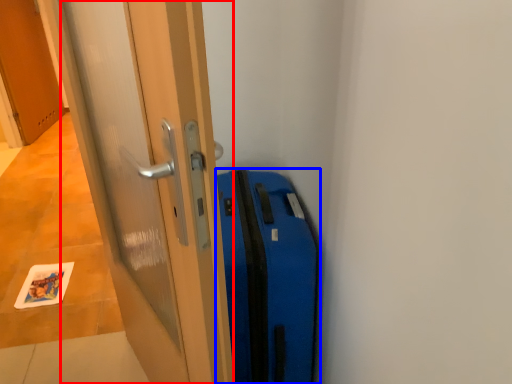
Question: Which of the following is the farthest to the observer, door (highlighted by a red box) or suitcase (highlighted by a blue box)?

Choices:
 (A) door
 (B) suitcase

Answer: (B)